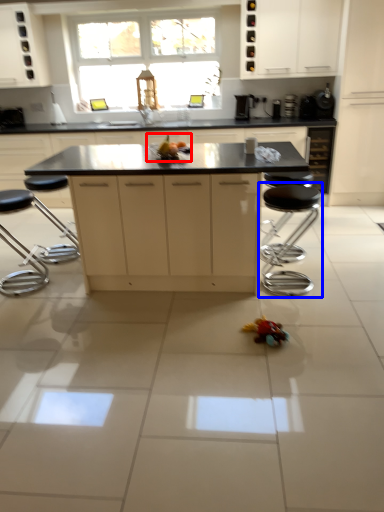
Question: Which object is closer to the camera taking this photo, toy (highlighted by a red box) or bar stool (highlighted by a blue box)?

Choices:
 (A) toy
 (B) bar stool

Answer: (B)